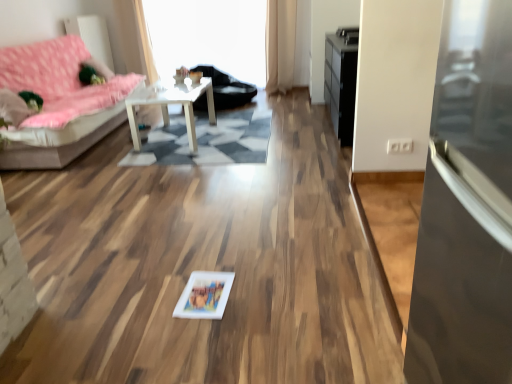
The width and height of the screenshot is (512, 384). Describe the element at coordinates (172, 103) in the screenshot. I see `white glossy table at center` at that location.

Locate an element on the screen. white glossy picture frame at center is located at coordinates (204, 295).

Describe the element at coordinates (227, 88) in the screenshot. Image resolution: width=512 pixels, height=384 pixels. I see `black leather armchair at center` at that location.

Describe the element at coordinates (466, 207) in the screenshot. I see `transparent glass door at right` at that location.

The height and width of the screenshot is (384, 512). What do you see at coordinates (209, 36) in the screenshot?
I see `transparent glass window screen at upper center` at bounding box center [209, 36].

Find the location of a particular element. white glossy table at center is located at coordinates (172, 103).

Considering the relative sizes of beige fabric curtain at upper center and transparent glass window screen at upper center in the image provided, is beige fabric curtain at upper center thinner than transparent glass window screen at upper center?

Correct, the width of beige fabric curtain at upper center is less than that of transparent glass window screen at upper center.

Considering the points (268, 82) and (182, 34), which point is in front, point (268, 82) or point (182, 34)?

The point (182, 34) is in front.

In the scene shown: Considering the sizes of objects beige fabric curtain at upper center and transparent glass window screen at upper center in the image provided, who is bigger, beige fabric curtain at upper center or transparent glass window screen at upper center?

transparent glass window screen at upper center.

Between beige fabric curtain at upper center and black leather armchair at center, which one has larger width?

Wider between the two is black leather armchair at center.

Which is more to the right, beige fabric curtain at upper center or black leather armchair at center?

Positioned to the right is beige fabric curtain at upper center.

Is there a large distance between beige fabric curtain at upper center and black leather armchair at center?

No, beige fabric curtain at upper center is not far away from black leather armchair at center.

From the image's perspective, is beige fabric curtain at upper center above or below black leather armchair at center?

Based on their image positions, beige fabric curtain at upper center is located above black leather armchair at center.

Considering the relative sizes of white glossy table at center and black glossy dresser at upper right in the image provided, is white glossy table at center thinner than black glossy dresser at upper right?

Incorrect, the width of white glossy table at center is not less than that of black glossy dresser at upper right.

Which point is more forward, (206, 92) or (353, 45)?

The point (353, 45) is in front.

Would you say white glossy table at center contains black glossy dresser at upper right?

No, black glossy dresser at upper right is not a part of white glossy table at center.

Considering the positions of objects white glossy table at center and black glossy dresser at upper right in the image provided, who is more to the right, white glossy table at center or black glossy dresser at upper right?

black glossy dresser at upper right is more to the right.

From a real-world perspective, is pink fabric studio couch at left positioned above or below transparent glass window screen at upper center?

Clearly, from a real-world perspective, pink fabric studio couch at left is below transparent glass window screen at upper center.

Is pink fabric studio couch at left shorter than transparent glass window screen at upper center?

Yes, pink fabric studio couch at left is shorter than transparent glass window screen at upper center.

Is the depth of pink fabric studio couch at left less than that of transparent glass window screen at upper center?

That is True.

Is point (49, 137) in front of point (164, 44)?

Yes, point (49, 137) is closer to viewer.

Is transparent glass door at right at the back of white glossy table at center?

No, white glossy table at center is not facing the opposite direction of transparent glass door at right.

In the scene shown: From a real-world perspective, is white glossy table at center over transparent glass door at right?

No, from a real-world perspective, white glossy table at center is not on top of transparent glass door at right.

From their relative heights in the image, would you say white glossy table at center is taller or shorter than transparent glass door at right?

In the image, white glossy table at center appears to be shorter than transparent glass door at right.

Is point (204, 83) positioned in front of point (493, 203)?

No, (204, 83) is further to viewer.

How many degrees apart are the facing directions of black glossy dresser at upper right and beige fabric curtain at upper center?

90 degrees.

Looking at the image, does black glossy dresser at upper right seem bigger or smaller compared to beige fabric curtain at upper center?

In the image, black glossy dresser at upper right appears to be larger than beige fabric curtain at upper center.

Locate an element on the screen. This screenshot has width=512, height=384. curtain to the left of black glossy dresser at upper right is located at coordinates [280, 44].

In the scene shown: Is black glossy dresser at upper right turned away from beige fabric curtain at upper center?

No.

Considering the positions of points (192, 109) and (206, 294), is point (192, 109) farther from camera compared to point (206, 294)?

Yes, it is.

Is white glossy table at center facing away from white glossy picture frame at center?

white glossy table at center is not turned away from white glossy picture frame at center.

Is white glossy picture frame at center surrounded by white glossy table at center?

No, white glossy picture frame at center is not a part of white glossy table at center.

Image resolution: width=512 pixels, height=384 pixels. What are the coordinates of `window screen that appears behind the beige fabric curtain at upper center` in the screenshot? It's located at (209, 36).

Locate an element on the screen. The height and width of the screenshot is (384, 512). armchair in front of the beige fabric curtain at upper center is located at coordinates (227, 88).

Estimate the real-world distances between objects in this image. Which object is closer to pink fabric studio couch at left, transparent glass window screen at upper center or beige fabric curtain at upper center?

transparent glass window screen at upper center is positioned closer to the anchor pink fabric studio couch at left.

Looking at the image, which one is located further to transparent glass door at right, pink fabric studio couch at left or black glossy dresser at upper right?

Based on the image, pink fabric studio couch at left appears to be further to transparent glass door at right.

Looking at the image, which one is located further to transparent glass window screen at upper center, beige fabric curtain at upper center or white glossy table at center?

The object further to transparent glass window screen at upper center is white glossy table at center.

Looking at this image, looking at the image, which one is located further to beige fabric curtain at upper center, white glossy picture frame at center or black glossy dresser at upper right?

The object further to beige fabric curtain at upper center is white glossy picture frame at center.

Estimate the real-world distances between objects in this image. Which object is further from black glossy dresser at upper right, beige fabric curtain at upper center or white glossy table at center?

beige fabric curtain at upper center is further to black glossy dresser at upper right.

From the image, which object appears to be nearer to black leather armchair at center, white glossy table at center or pink fabric studio couch at left?

white glossy table at center is positioned closer to the anchor black leather armchair at center.

Considering their positions, is transparent glass door at right positioned further to white glossy picture frame at center than transparent glass window screen at upper center?

Based on the image, transparent glass window screen at upper center appears to be further to white glossy picture frame at center.

When comparing their distances from white glossy picture frame at center, does beige fabric curtain at upper center or pink fabric studio couch at left seem closer?

The object closer to white glossy picture frame at center is pink fabric studio couch at left.

The image size is (512, 384). I want to click on armchair between white glossy table at center and transparent glass window screen at upper center in the front-back direction, so click(x=227, y=88).

The width and height of the screenshot is (512, 384). In order to click on picture frame positioned between transparent glass door at right and white glossy table at center from near to far in this screenshot , I will do `click(204, 295)`.

You are a GUI agent. You are given a task and a screenshot of the screen. Output one action in this format:
    pyautogui.click(x=<x>, y=<y>)
    Task: Click on the table positioned between pink fabric studio couch at left and beige fabric curtain at upper center from near to far
    The height and width of the screenshot is (384, 512).
    Given the screenshot: What is the action you would take?
    pyautogui.click(x=172, y=103)

Find the location of a particular element. This screenshot has height=384, width=512. picture frame between transparent glass door at right and black glossy dresser at upper right along the z-axis is located at coordinates (204, 295).